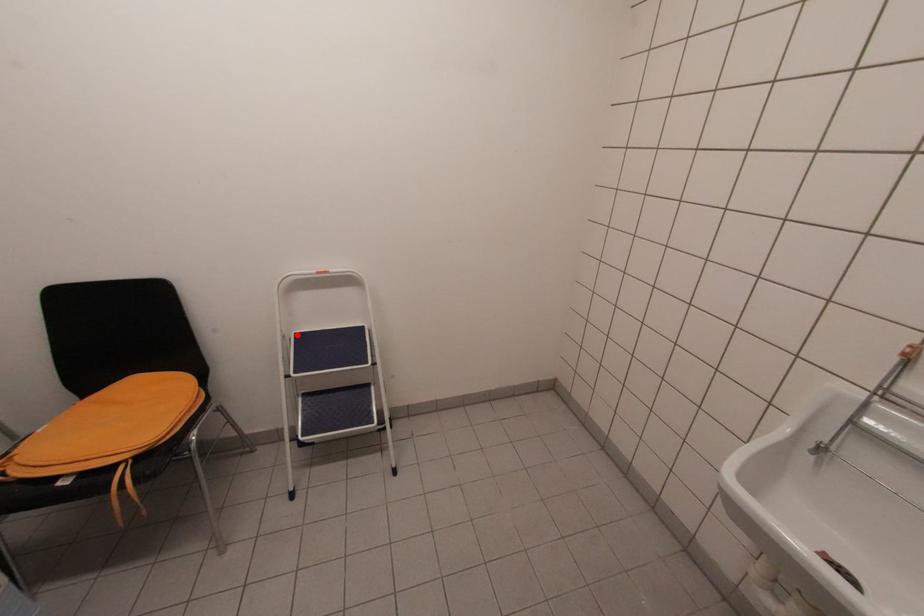
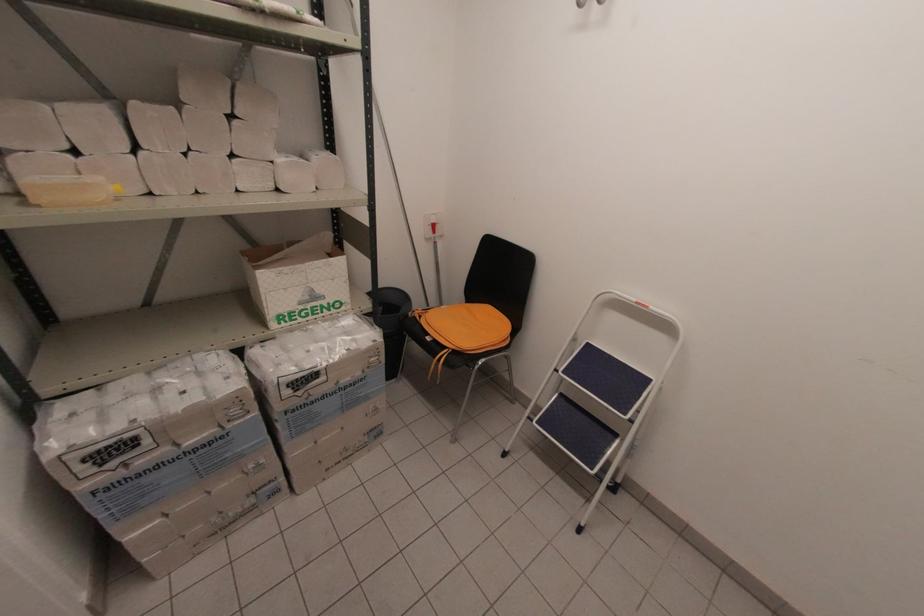
Find the pixel in the second image that matches the highlighted location in the first image.

(589, 344)